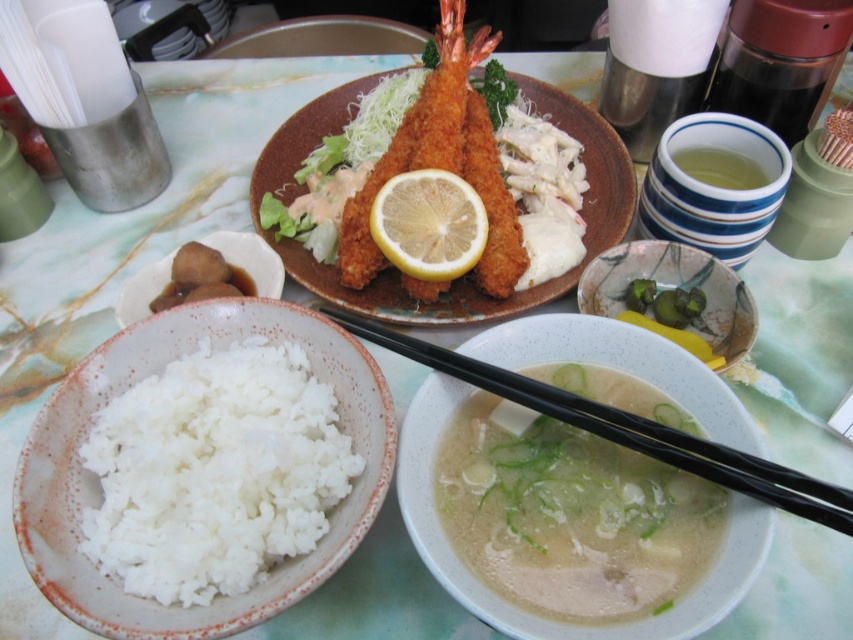
Question: Does white creamy soup at center appear on the left side of speckled ceramic bowl at center?

Choices:
 (A) yes
 (B) no

Answer: (A)

Question: Among these points, which one is nearest to the camera?

Choices:
 (A) (590, 419)
 (B) (482, 179)
 (C) (614, 257)
 (D) (184, 257)

Answer: (A)

Question: Which point appears closest to the camera in this image?

Choices:
 (A) (494, 371)
 (B) (471, 404)

Answer: (A)

Question: Considering the relative positions of speckled ceramic bowl at center and brown glossy dumplings at lower left in the image provided, where is speckled ceramic bowl at center located with respect to brown glossy dumplings at lower left?

Choices:
 (A) below
 (B) above

Answer: (A)

Question: Among these points, which one is farthest from the camera?

Choices:
 (A) (119, 488)
 (B) (428, 198)

Answer: (B)

Question: Does white creamy soup at center have a greater width compared to yellow matte lemon at center?

Choices:
 (A) no
 (B) yes

Answer: (B)